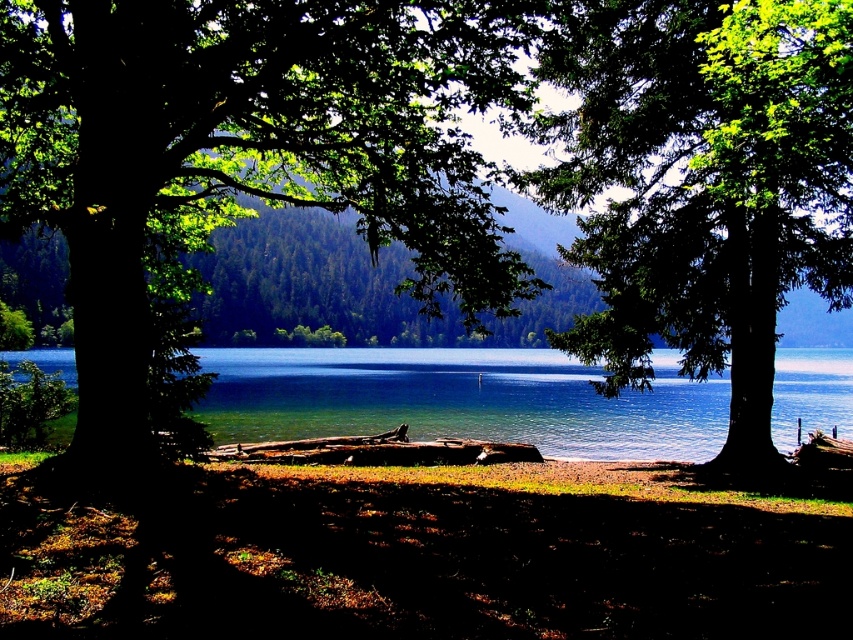
Who is positioned more to the right, brown dirt at lower center or green leafy tree at center?

green leafy tree at center is more to the right.

Is point (747, 506) positioned in front of point (610, 236)?

Yes, it is in front of point (610, 236).

Identify the location of brown dirt at lower center. (422, 556).

Does brown dirt at lower center have a smaller size compared to clear blue water at center?

Yes.

Is point (397, 532) positioned behind point (822, 376)?

No, it is in front of (822, 376).

Identify the location of brown dirt at lower center. (422, 556).

Between point (381, 45) and point (665, 480), which one is positioned in front?

Point (381, 45) is more forward.

Does green leafy tree at left appear on the left side of brown dirt at lower center?

Indeed, green leafy tree at left is positioned on the left side of brown dirt at lower center.

Where is `green leafy tree at left`? This screenshot has width=853, height=640. green leafy tree at left is located at coordinates (241, 166).